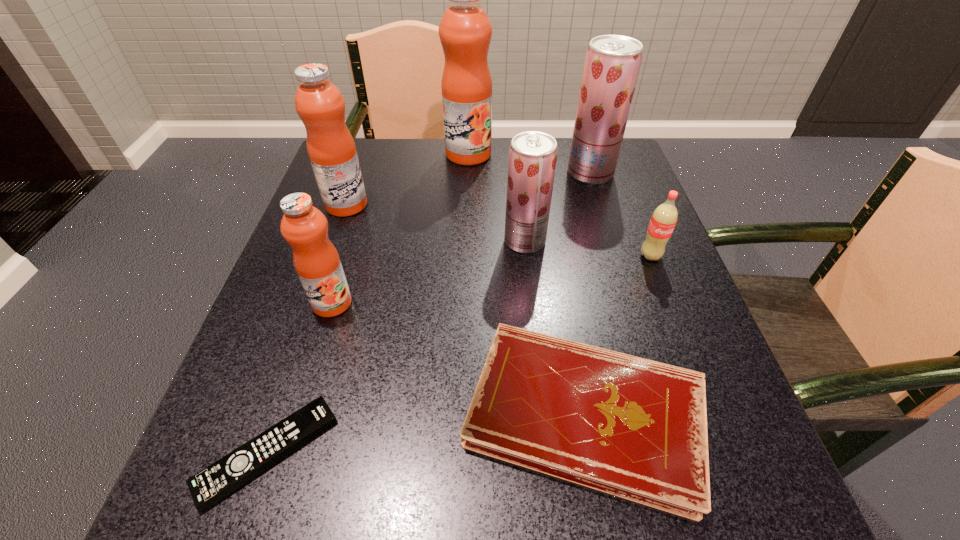
Locate an element on the screen. vacant space situated 0.150m on the back of the second shortest object is located at coordinates (560, 271).

What are the coordinates of `free region located 0.090m on the right of the shortest object` in the screenshot? It's located at (396, 452).

Identify the location of notebook that is positioned at the near edge. This screenshot has width=960, height=540. (634, 428).

Where is `remote control positioned at the near edge`? Image resolution: width=960 pixels, height=540 pixels. remote control positioned at the near edge is located at coordinates (221, 478).

Where is `remote control that is positioned at the left edge`? The image size is (960, 540). remote control that is positioned at the left edge is located at coordinates (221, 478).

I want to click on fruit juice that is at the right edge, so click(612, 63).

Image resolution: width=960 pixels, height=540 pixels. What are the coordinates of `soda that is positioned at the right edge` in the screenshot? It's located at (664, 218).

This screenshot has height=540, width=960. Identify the location of notebook that is at the right edge. (634, 428).

Where is `object that is positioned at the near left corner`? Image resolution: width=960 pixels, height=540 pixels. object that is positioned at the near left corner is located at coordinates (221, 478).

Where is `object that is at the far right corner`? The width and height of the screenshot is (960, 540). object that is at the far right corner is located at coordinates [612, 63].